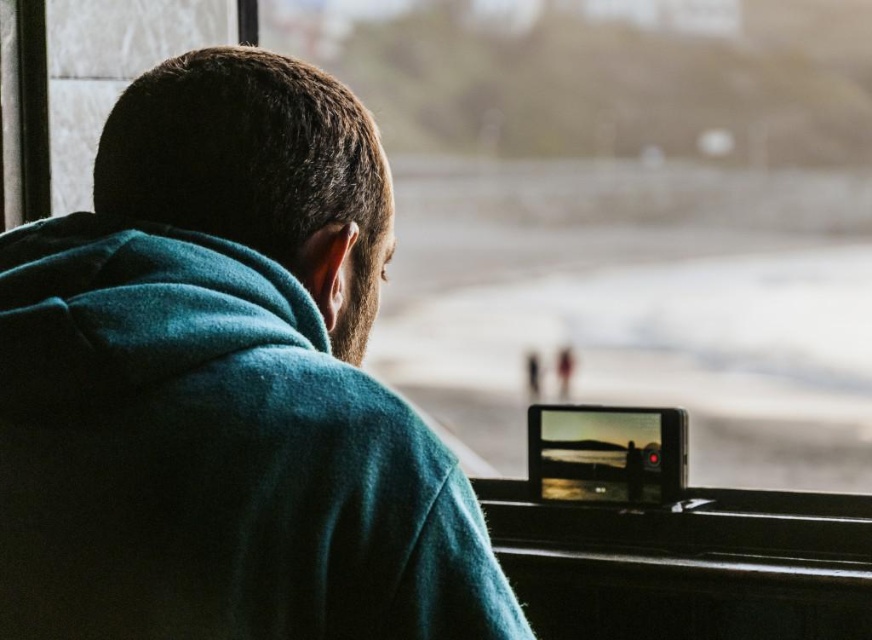
You are a passenger on a bus and want to take a photo of a specific point outside the window. The point you want to capture is located at coordinates point (404, 612). The camera you have can only focus on objects within 30 inches from the window. Will the point be in focus?

The point (404, 612) is 31.06 inches away from the camera, which is slightly beyond the camera focus range of 30 inches. Therefore, the point will not be in focus.

You are a passenger on a bus or train and want to know where the teal fleece jacket at upper left is positioned relative to the window. Can you determine its location using the coordinates provided?

The teal fleece jacket at upper left is located at point [223,387], which means it is positioned near the upper left area of the scene, likely close to the window where the passenger is seated.

You are a passenger on the train and want to look out the transparent glass train window at center. Is the teal fleece jacket at upper left blocking your view of the window?

The teal fleece jacket at upper left is in front of the transparent glass train window at center, so it is blocking your view of the window.